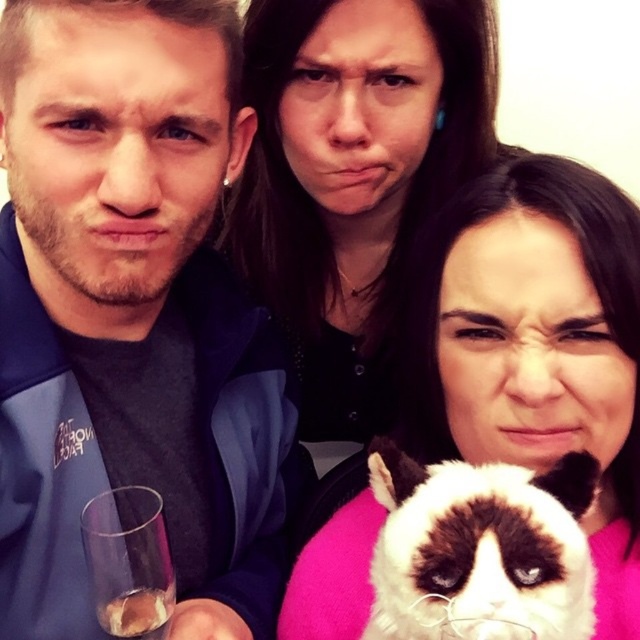
You are a photographer setting up for a group photo. You have a matte black cat at center and a transparent glass at lower left in the frame. The cat is known to be easily startled by sudden movements. To avoid spooking the cat, you need to ensure the glass remains at least 15 inches away from it. Based on the scene, will you need to adjust the glass position?

The matte black cat at center and transparent glass at lower left are 14.67 inches apart from each other. Since 14.67 inches is less than the required 15 inches, you will need to adjust the glass position to maintain a safe distance.

You are taking a photo of the matte black cat at center. Where should you position your camera to ensure the cat is centered in the frame?

The matte black cat at center is located at point coordinates (534, 346), so you should position your camera to focus on those coordinates to center the cat in the frame.

You are a photographer trying to capture a group photo. You notice the matte blue jacket at left and the matte black cat at center. Which object is located to the left of the other?

The matte blue jacket at left is positioned on the left side of the matte black cat at center, so the matte blue jacket at left is to the left of the matte black cat at center.